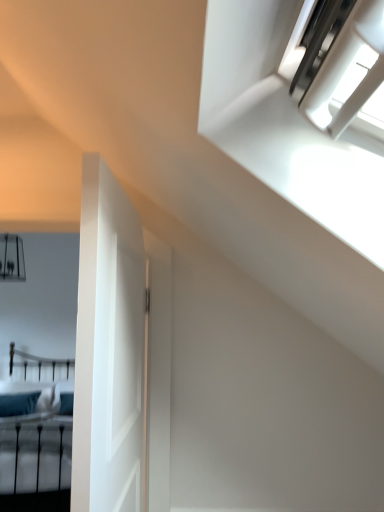
Question: Looking at the image, does teal fabric bed at lower left seem bigger or smaller compared to white matte door at left?

Choices:
 (A) big
 (B) small

Answer: (A)

Question: Considering the positions of teal fabric bed at lower left and white matte door at left in the image, is teal fabric bed at lower left taller or shorter than white matte door at left?

Choices:
 (A) tall
 (B) short

Answer: (A)

Question: Considering the real-world distances, which object is farthest from the teal fabric bed at lower left?

Choices:
 (A) white matte door at left
 (B) teal fabric pillow at lower left

Answer: (A)

Question: Estimate the real-world distances between objects in this image. Which object is closer to the white matte door at left?

Choices:
 (A) teal fabric bed at lower left
 (B) teal fabric pillow at lower left

Answer: (A)